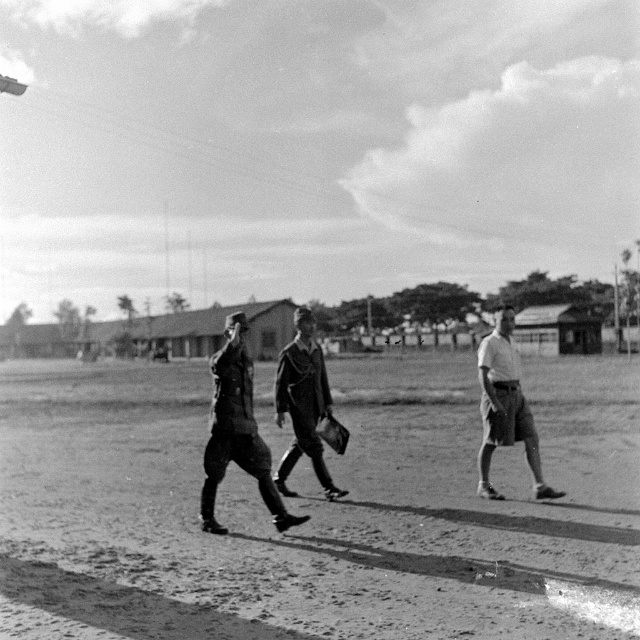
Question: Which object appears closest to the camera in this image?

Choices:
 (A) uniformed man at center
 (B) dirt field at center

Answer: (B)

Question: Which point is farther from the camera taking this photo?

Choices:
 (A) (310, 356)
 (B) (480, 358)

Answer: (A)

Question: From the image, what is the correct spatial relationship of dirt field at center in relation to uniformed man at center?

Choices:
 (A) right
 (B) left

Answer: (A)

Question: Which object is positioned farthest from the uniformed man at center?

Choices:
 (A) light gray shorts at right
 (B) dark gray uniform at center

Answer: (A)

Question: Is dark gray uniform at center smaller than light gray shorts at right?

Choices:
 (A) yes
 (B) no

Answer: (B)

Question: From the image, what is the correct spatial relationship of dirt field at center in relation to dark gray uniform at center?

Choices:
 (A) below
 (B) above

Answer: (A)